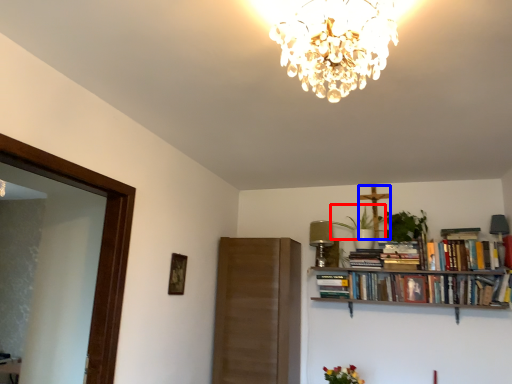
Question: Which object appears farthest to the camera in this image, plant (highlighted by a red box) or crucifix (highlighted by a blue box)?

Choices:
 (A) plant
 (B) crucifix

Answer: (B)